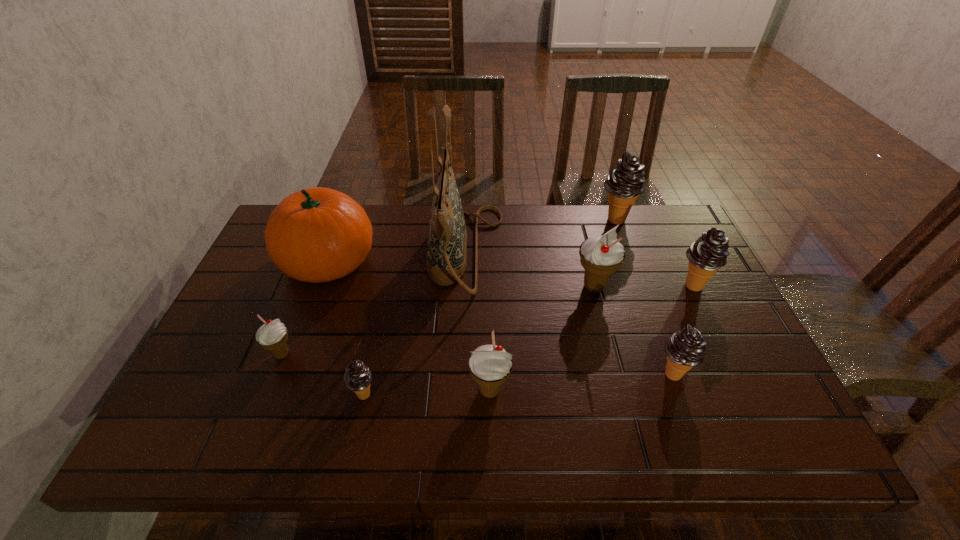
Find the location of a particular element. The image size is (960, 540). blank space located 0.340m on the back of the third biggest chocolate icecream is located at coordinates (633, 264).

At what (x,y) coordinates should I click in order to perform the action: click on vacant space situated 0.060m on the front of the third icecream from left to right. Please return your answer as a coordinate pair (x, y). Image resolution: width=960 pixels, height=540 pixels. Looking at the image, I should click on (491, 435).

Locate an element on the screen. This screenshot has height=540, width=960. vacant space located 0.370m on the back of the leftmost icecream is located at coordinates (324, 246).

The image size is (960, 540). In order to click on vacant area located 0.310m on the left of the sixth icecream from right to left in this screenshot , I will do `click(211, 395)`.

This screenshot has height=540, width=960. I want to click on handbag that is at the far edge, so click(447, 237).

This screenshot has height=540, width=960. Identify the location of icecream that is positioned at the far edge. (625, 182).

At what (x,y) coordinates should I click in order to perform the action: click on pumpkin that is at the far edge. Please return your answer as a coordinate pair (x, y). Looking at the image, I should click on [x=318, y=234].

Locate an element on the screen. The width and height of the screenshot is (960, 540). pumpkin located at the left edge is located at coordinates (318, 234).

This screenshot has height=540, width=960. In order to click on icecream at the left edge in this screenshot , I will do `click(273, 335)`.

The width and height of the screenshot is (960, 540). Identify the location of object at the far left corner. (318, 234).